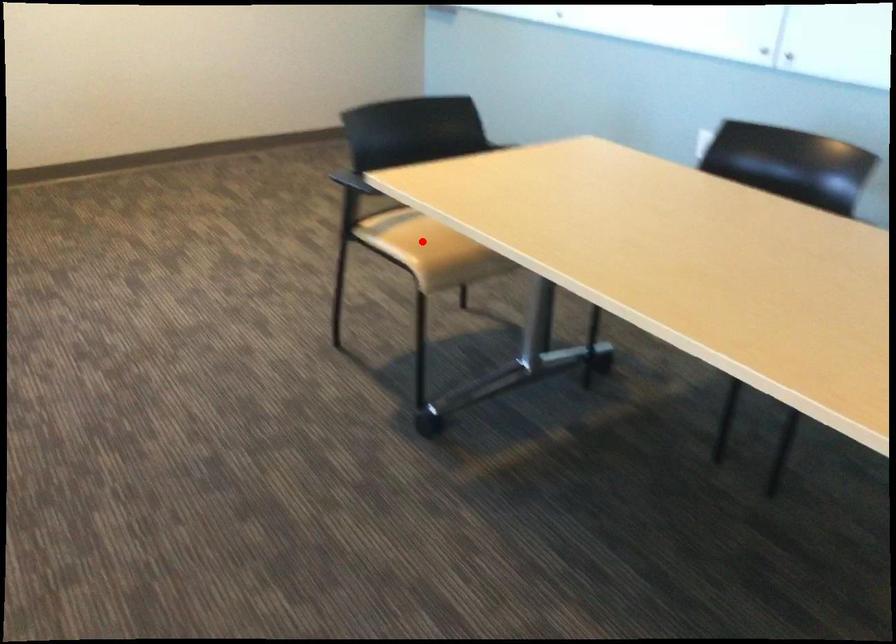
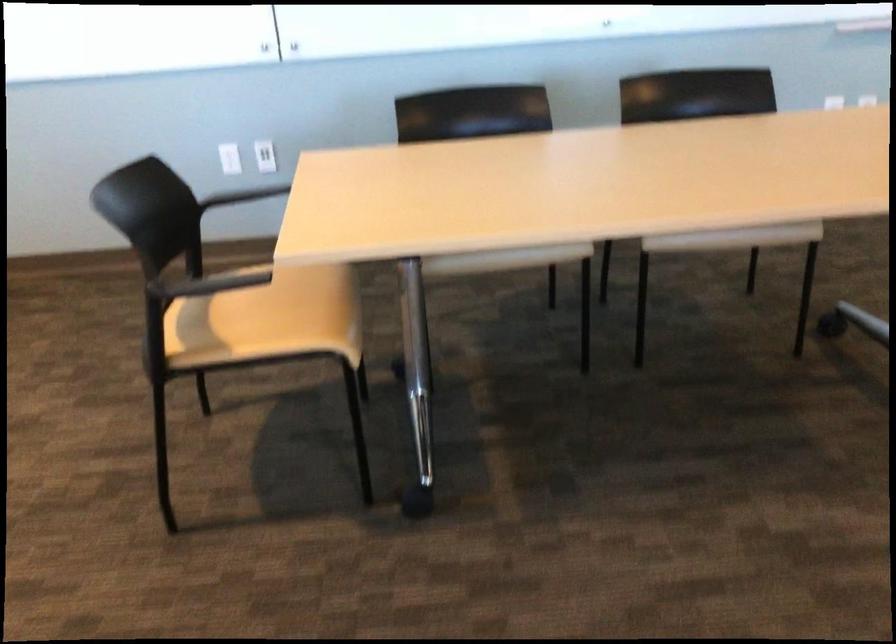
Question: A red point is marked in image1. In image2, is the corresponding 3D point closer to the camera or farther? Reply with the corresponding letter.

Choices:
 (A) The corresponding 3D point is closer.
 (B) The corresponding 3D point is farther.

Answer: (A)